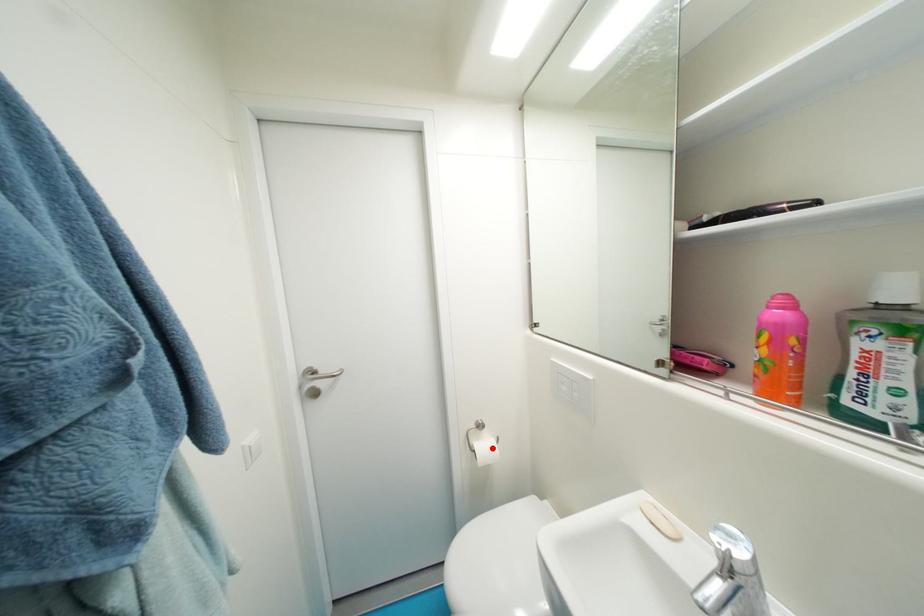
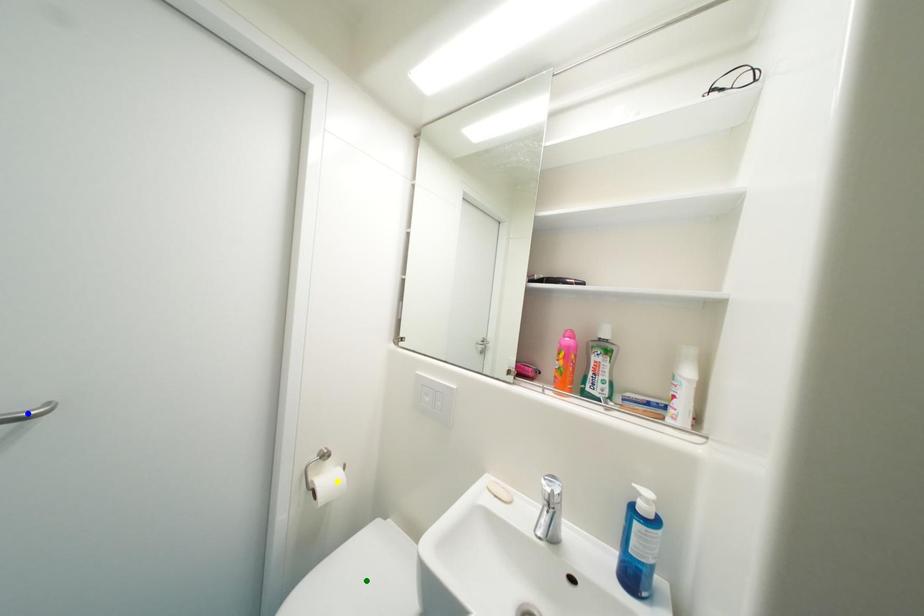
Question: I am providing you with two images of the same scene from different viewpoints. A red point is marked on the first image. You are given multiple points on the second image. Which point in image 2 is actually the same real-world point as the red point in image 1?

Choices:
 (A) yellow point
 (B) green point
 (C) blue point

Answer: (A)